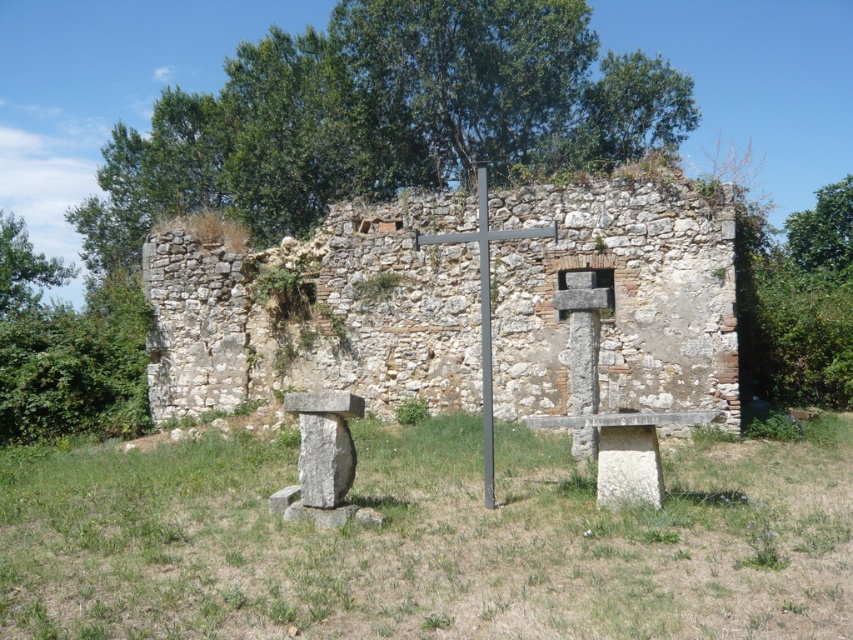
Question: Is weathered stone ruins at center to the right of green leafy tree at upper center from the viewer's perspective?

Choices:
 (A) no
 (B) yes

Answer: (A)

Question: Which object appears farthest from the camera in this image?

Choices:
 (A) green grass at center
 (B) green leafy tree at upper left
 (C) green leafy tree at upper right
 (D) weathered stone ruins at center

Answer: (C)

Question: Which object appears farthest from the camera in this image?

Choices:
 (A) weathered stone ruins at center
 (B) green grass at center

Answer: (A)

Question: Can you confirm if green grass at center is thinner than weathered stone ruins at center?

Choices:
 (A) no
 (B) yes

Answer: (A)

Question: Can you confirm if metallic cross at center is positioned below green leafy tree at upper left?

Choices:
 (A) no
 (B) yes

Answer: (B)

Question: Which point is closer to the camera?

Choices:
 (A) (471, 401)
 (B) (483, 528)

Answer: (B)